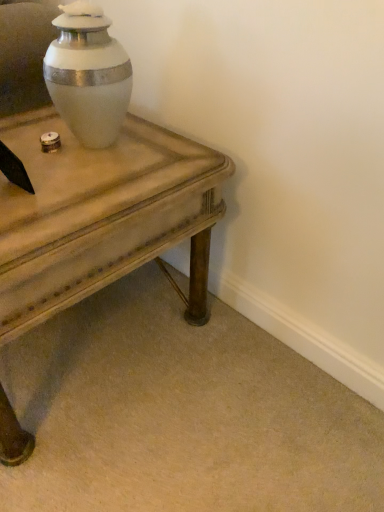
Find the location of `empty space that is ontop of wooden side table at center (from a real-world perspective)`. empty space that is ontop of wooden side table at center (from a real-world perspective) is located at coordinates (81, 156).